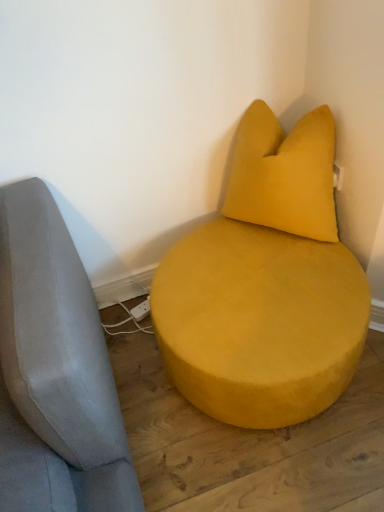
Question: In terms of size, does velvet yellow pillow at upper right appear bigger or smaller than suede yellow ottoman at center?

Choices:
 (A) big
 (B) small

Answer: (B)

Question: Is velvet yellow pillow at upper right wider or thinner than suede yellow ottoman at center?

Choices:
 (A) wide
 (B) thin

Answer: (B)

Question: Considering the relative positions of velvet yellow pillow at upper right and suede yellow ottoman at center in the image provided, is velvet yellow pillow at upper right to the left or to the right of suede yellow ottoman at center?

Choices:
 (A) left
 (B) right

Answer: (B)

Question: Looking at their shapes, would you say suede yellow ottoman at center is wider or thinner than velvet yellow pillow at upper right?

Choices:
 (A) thin
 (B) wide

Answer: (B)

Question: From a real-world perspective, is suede yellow ottoman at center positioned above or below velvet yellow pillow at upper right?

Choices:
 (A) above
 (B) below

Answer: (B)

Question: In terms of height, does suede yellow ottoman at center look taller or shorter compared to velvet yellow pillow at upper right?

Choices:
 (A) short
 (B) tall

Answer: (A)

Question: From the image's perspective, is suede yellow ottoman at center above or below velvet yellow pillow at upper right?

Choices:
 (A) above
 (B) below

Answer: (B)